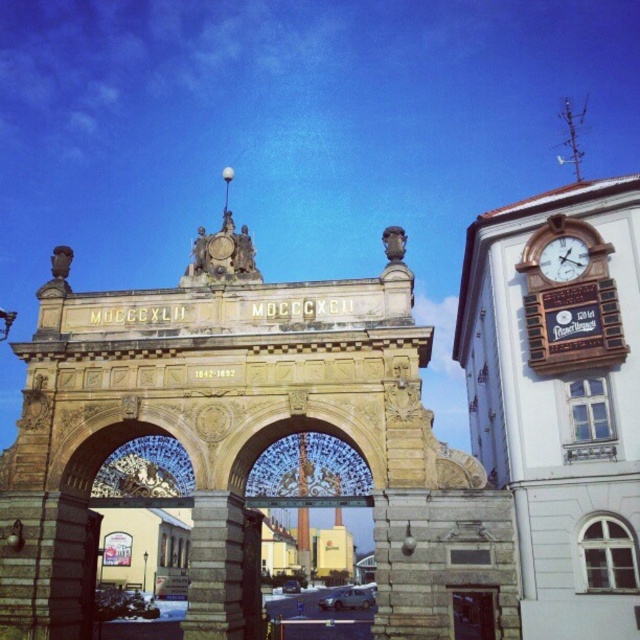
Based on the photo, is brown wooden door at center wider than gold metallic clock at upper right?

Yes, brown wooden door at center is wider than gold metallic clock at upper right.

Who is lower down, brown wooden door at center or gold metallic clock at upper right?

Positioned lower is brown wooden door at center.

Does point (465, 588) come farther from viewer compared to point (563, 260)?

No.

Identify the location of brown wooden door at center. The width and height of the screenshot is (640, 640). (474, 612).

Measure the distance between golden stone arch at center and brown wooden door at center.

golden stone arch at center is 20.26 meters from brown wooden door at center.

Based on the photo, is golden stone arch at center taller than brown wooden door at center?

Indeed, golden stone arch at center has a greater height compared to brown wooden door at center.

Between point (148, 330) and point (456, 636), which one is positioned behind?

Positioned behind is point (148, 330).

Image resolution: width=640 pixels, height=640 pixels. What are the coordinates of `golden stone arch at center` in the screenshot? It's located at (243, 436).

Is golden stone arch at center bigger than gold metallic clock at upper right?

Yes.

Is golden stone arch at center behind gold metallic clock at upper right?

No, golden stone arch at center is closer to the viewer.

Does point (6, 497) lie in front of point (579, 253)?

That is False.

Find the location of a particular element. The width and height of the screenshot is (640, 640). golden stone arch at center is located at coordinates (243, 436).